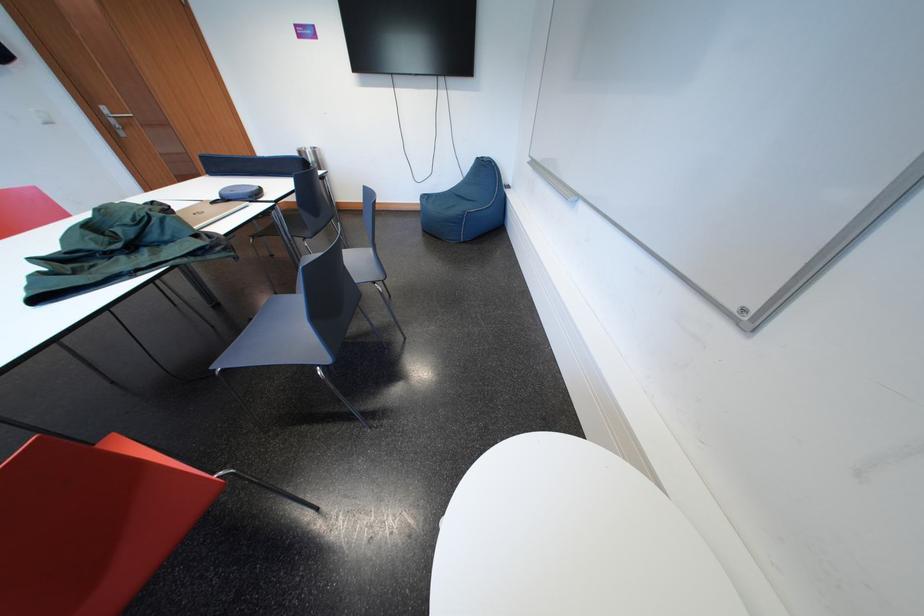
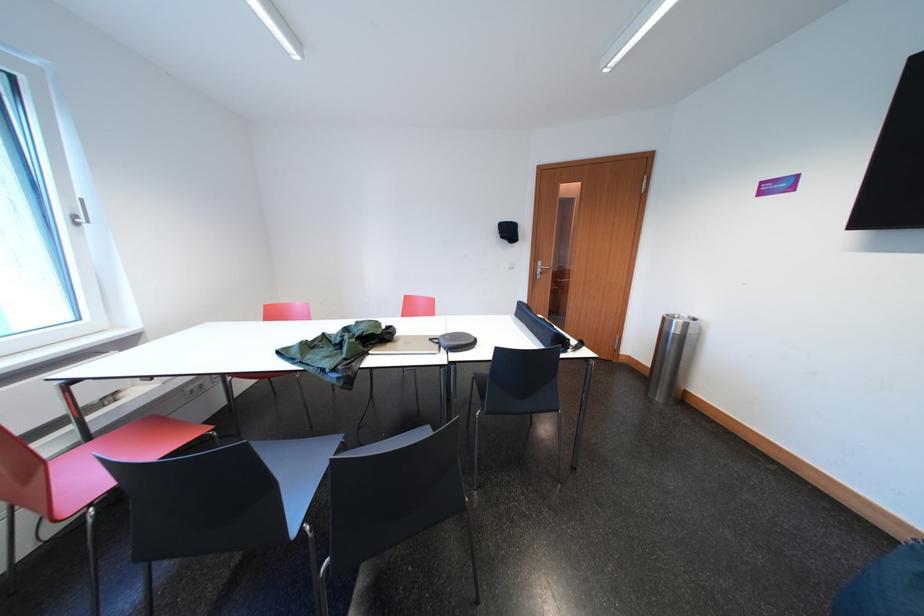
The point at (310,158) is marked in the first image. Where is the corresponding point in the second image?

(675, 325)